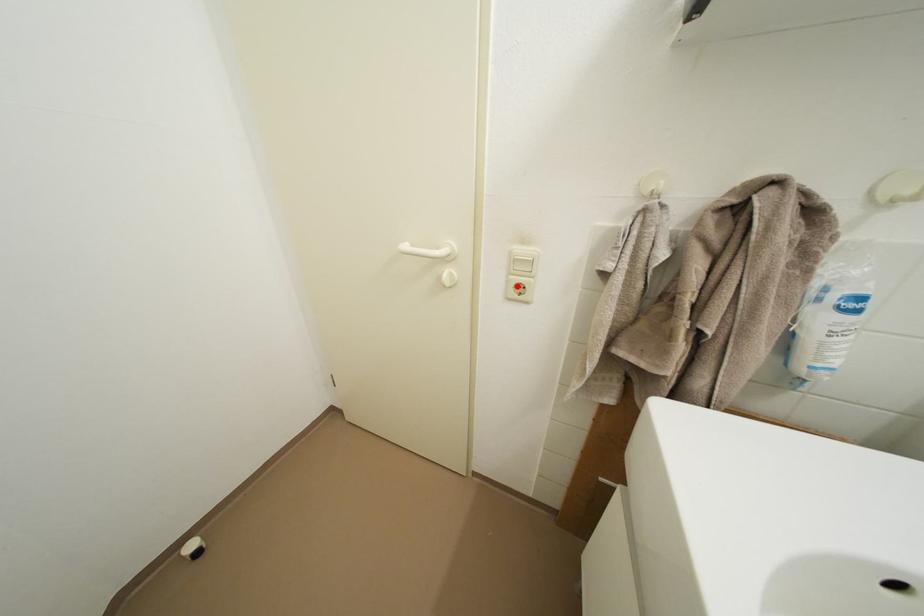
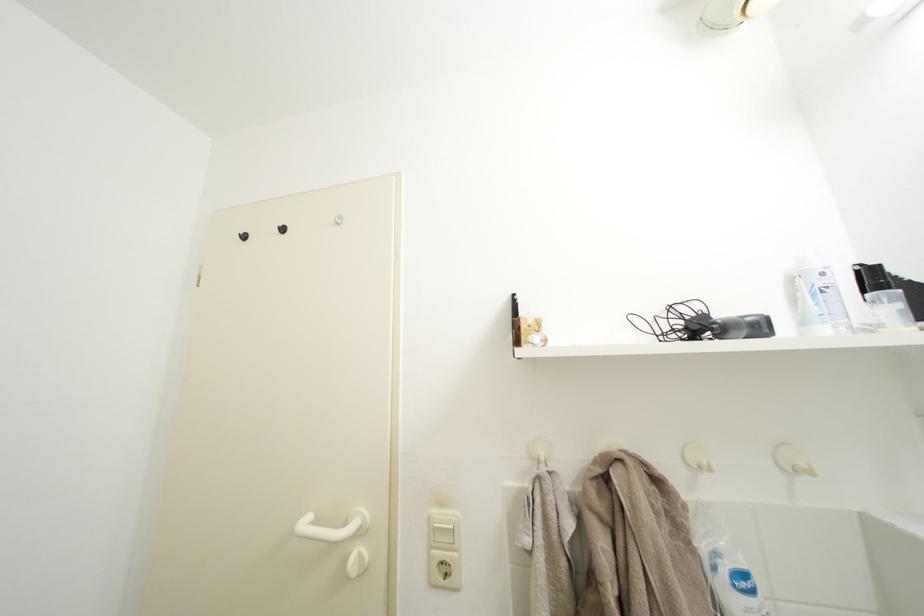
The point at the highlighted location is marked in the first image. Where is the corresponding point in the second image?

(439, 562)